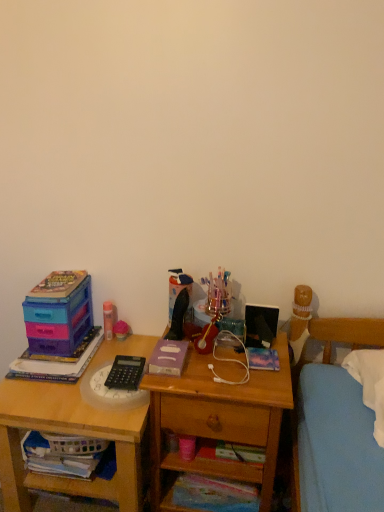
In order to click on vacant area to the left of metallic blue book at center, which ranks as the 1th book in right-to-left order in this screenshot , I will do `click(207, 357)`.